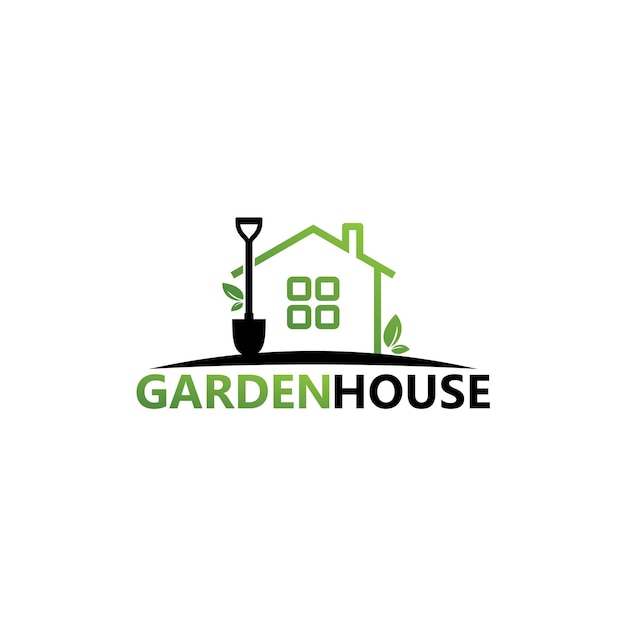
Locate an element on the screen. The image size is (626, 626). chimney is located at coordinates (350, 228).